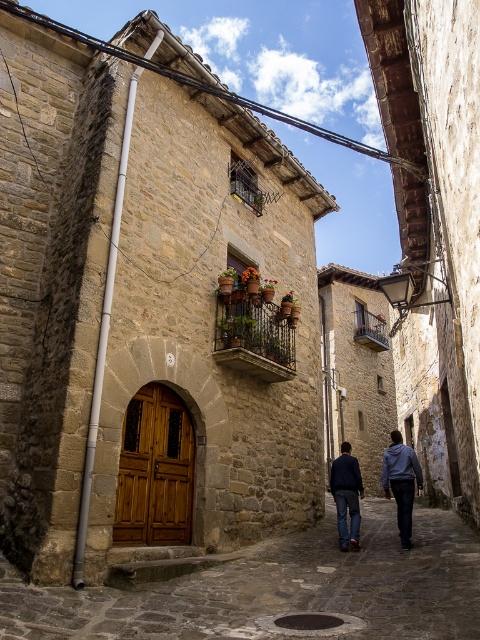
Consider the image. You are a delivery person standing at the entrance of the building on the left. You need to deliver a package to the person wearing the dark gray hoodie at center and dark blue denim jeans at center. Which direction should you turn to face the person?

The dark gray hoodie at center is positioned on the right side of dark blue denim jeans at center, so you should turn to your right to face the person wearing both the dark gray hoodie at center and dark blue denim jeans at center.

Looking at this image, you are a delivery person carrying a large package that is 1.5 meters wide. You need to navigate through the narrow stone cobblestone alley at center and the dark blue jeans at center. Which path should you choose to ensure your package can fit through?

The dark blue jeans at center occupies more space than the stone cobblestone alley at center, so you should choose the dark blue jeans at center path since it can accommodate the 1.5 meter wide package.

From the picture: You are a delivery person carrying a package and need to walk through the stone cobblestone alley at center. You are wearing dark blue jeans at center. Can you walk through the alley without bending down?

The stone cobblestone alley at center is not as tall as dark blue jeans at center, meaning the alley is shorter in height than your jeans. This suggests the alley is too low for you to stand upright without bending down, so you would need to bend to pass through.